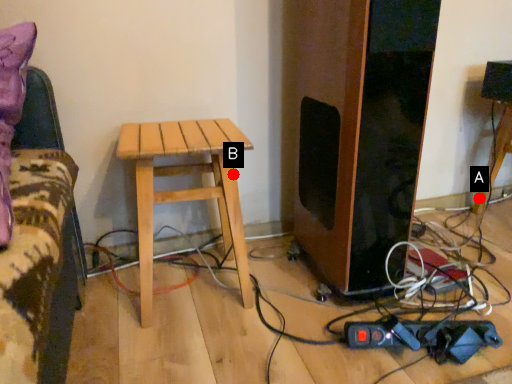
Question: Two points are circled on the image, labeled by A and B beside each circle. Which of the following is the farthest from the observer?

Choices:
 (A) A is further
 (B) B is further

Answer: (A)